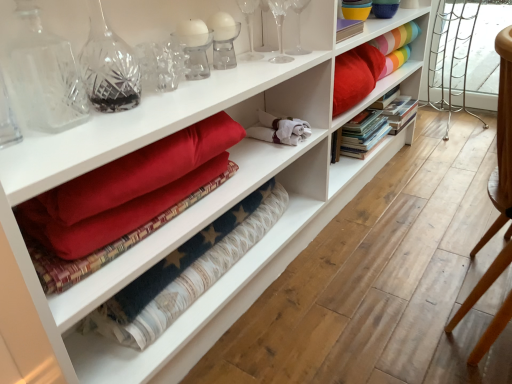
Question: In terms of height, does transparent glass wine glass at upper center, the 1th glass vase when ordered from right to left, look taller or shorter compared to hardcover books at center?

Choices:
 (A) tall
 (B) short

Answer: (A)

Question: In the image, is transparent glass wine glass at upper center, the third glass vase from the left, on the left side or the right side of hardcover books at center?

Choices:
 (A) left
 (B) right

Answer: (A)

Question: Based on their relative distances, which object is farther from the white textured fabric at center?

Choices:
 (A) rainbow striped fabric at upper right
 (B) wooden chair at right
 (C) crystal clear glass vase at upper left, the 1th glass vase positioned from the front
 (D) hardcover books at center
 (E) clear crystal glass at upper center, which appears as the second glass vase when viewed from the left

Answer: (A)

Question: Considering the real-world distances, which object is farthest from the transparent glass wine glass at upper center, the third glass vase from the left?

Choices:
 (A) clear crystal glass at upper center, which is the second glass vase in back-to-front order
 (B) crystal clear glass vase at upper left, arranged as the third glass vase when viewed from the back
 (C) white textured fabric at center
 (D) rainbow striped fabric at upper right
 (E) wooden chair at right

Answer: (E)